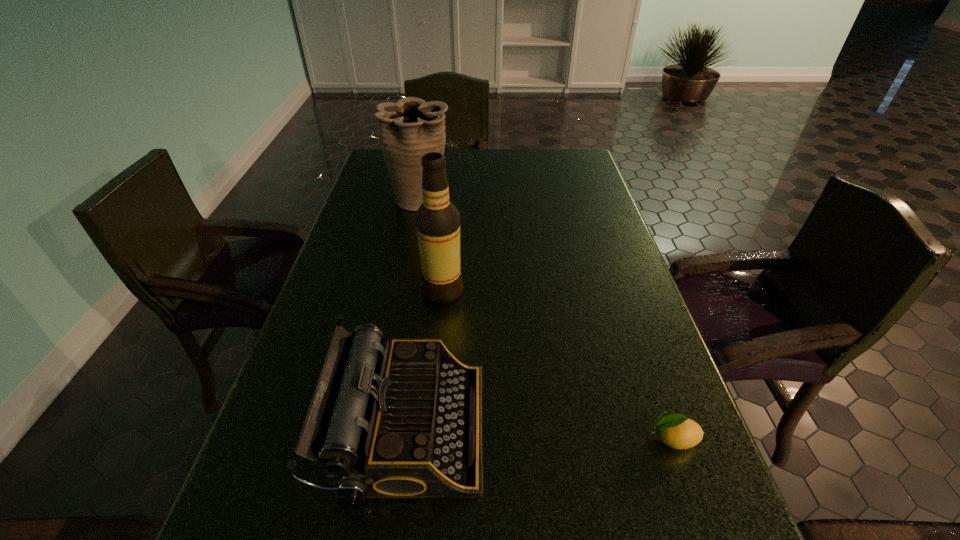
Locate an element on the screen. This screenshot has height=540, width=960. free space located with leaves positioned above the shortest object is located at coordinates point(600,438).

The height and width of the screenshot is (540, 960). I want to click on free space located with leaves positioned above the shortest object, so click(435, 438).

Where is `free location located with leaves positioned above the shortest object`? free location located with leaves positioned above the shortest object is located at coordinates (526, 438).

At what (x,y) coordinates should I click in order to perform the action: click on urn situated at the left edge. Please return your answer as a coordinate pair (x, y). The width and height of the screenshot is (960, 540). Looking at the image, I should click on (410, 128).

At what (x,y) coordinates should I click in order to perform the action: click on typewriter that is at the left edge. Please return your answer as a coordinate pair (x, y). Looking at the image, I should click on (405, 421).

I want to click on object present at the right edge, so click(677, 431).

I want to click on free region at the far edge, so (479, 176).

At what (x,y) coordinates should I click in order to perform the action: click on free space at the left edge. Please return your answer as a coordinate pair (x, y). This screenshot has height=540, width=960. Looking at the image, I should click on (393, 210).

The width and height of the screenshot is (960, 540). Find the location of `vacant space at the right edge`. vacant space at the right edge is located at coordinates (594, 330).

Identify the location of free spot between the lemon and the typewriter. This screenshot has height=540, width=960. (540, 433).